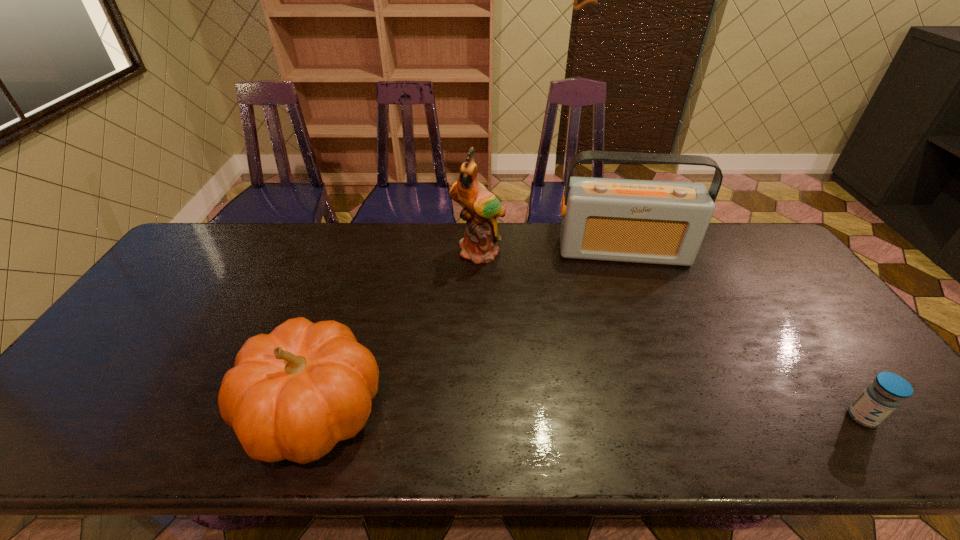
This screenshot has width=960, height=540. Identify the location of vacant spot on the desktop that is between the third tallest object and the shortest object and is positioned on the front-facing side of the parrot. (526, 414).

The image size is (960, 540). I want to click on free space on the desktop that is between the pumpkin and the medicine and is positioned on the front-facing side of the second object from right to left, so click(660, 415).